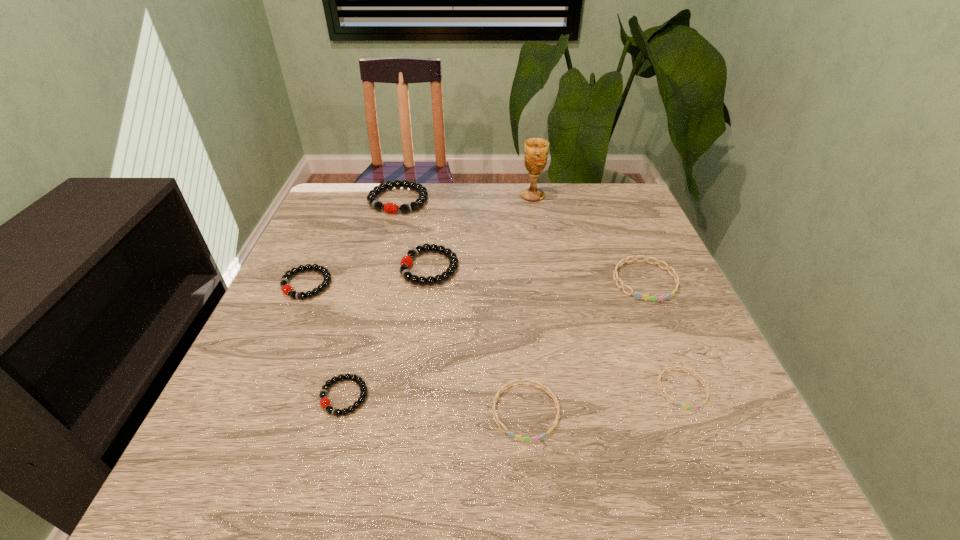
Identify the location of bracelet identified as the closest to the chalice. The width and height of the screenshot is (960, 540). (392, 208).

Where is `bracelet that stands as the third closest to the second biggest black bracelet`? Image resolution: width=960 pixels, height=540 pixels. bracelet that stands as the third closest to the second biggest black bracelet is located at coordinates (325, 403).

At what (x,y) coordinates should I click in order to perform the action: click on the closest black bracelet to the tallest bracelet. Please return your answer as a coordinate pair (x, y). Image resolution: width=960 pixels, height=540 pixels. Looking at the image, I should click on (406, 262).

Identify which black bracelet is the third closest to the third smallest black bracelet. Please provide its 2D coordinates. Your answer should be formatted as a tuple, i.e. [(x, y)], where the tuple contains the x and y coordinates of a point satisfying the conditions above.

[(325, 403)]

Select which blue bracelet appears as the closest to the biggest blue bracelet. Please provide its 2D coordinates. Your answer should be formatted as a tuple, i.e. [(x, y)], where the tuple contains the x and y coordinates of a point satisfying the conditions above.

[(665, 370)]

Identify which blue bracelet is located as the nearest to the nearest black bracelet. Please provide its 2D coordinates. Your answer should be formatted as a tuple, i.e. [(x, y)], where the tuple contains the x and y coordinates of a point satisfying the conditions above.

[(519, 437)]

In order to click on blank space that satisfies the following two spatial constraints: 1. on the back side of the tallest object; 2. on the right side of the farthest bracelet in this screenshot , I will do `click(399, 196)`.